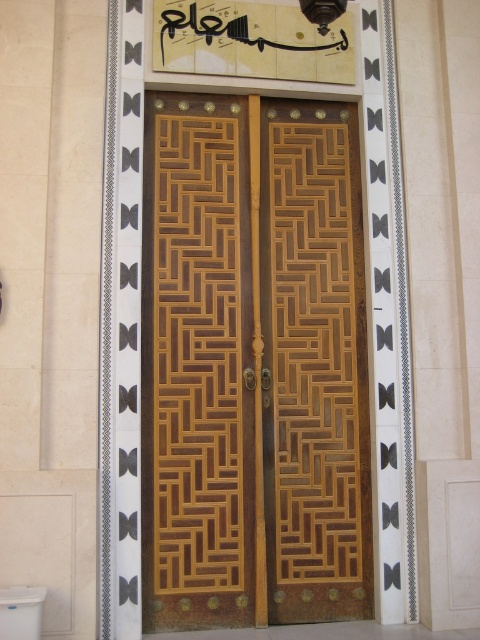
Question: Which object appears closest to the camera in this image?

Choices:
 (A) wooden door at center
 (B) white glossy toilet bowl at lower left

Answer: (B)

Question: Is wooden door at center positioned behind white glossy toilet bowl at lower left?

Choices:
 (A) yes
 (B) no

Answer: (A)

Question: Which object appears farthest from the camera in this image?

Choices:
 (A) wooden door at center
 (B) white glossy toilet bowl at lower left

Answer: (A)

Question: Is wooden door at center wider than white glossy toilet bowl at lower left?

Choices:
 (A) no
 (B) yes

Answer: (B)

Question: Which point is farther from the camera taking this photo?

Choices:
 (A) (15, 628)
 (B) (144, 608)

Answer: (B)

Question: Is wooden door at center positioned before white glossy toilet bowl at lower left?

Choices:
 (A) no
 (B) yes

Answer: (A)